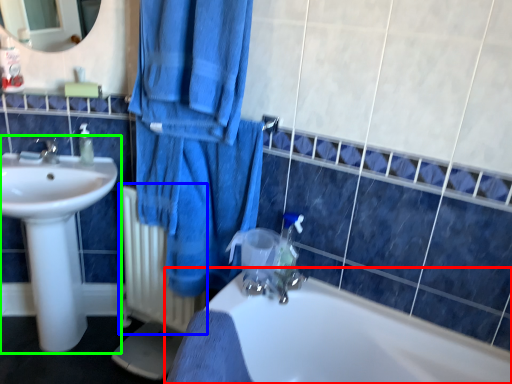
Question: Which object is the closest to the bathtub (highlighted by a red box)? Choose among these: radiator (highlighted by a blue box) or sink (highlighted by a green box).

Choices:
 (A) radiator
 (B) sink

Answer: (A)